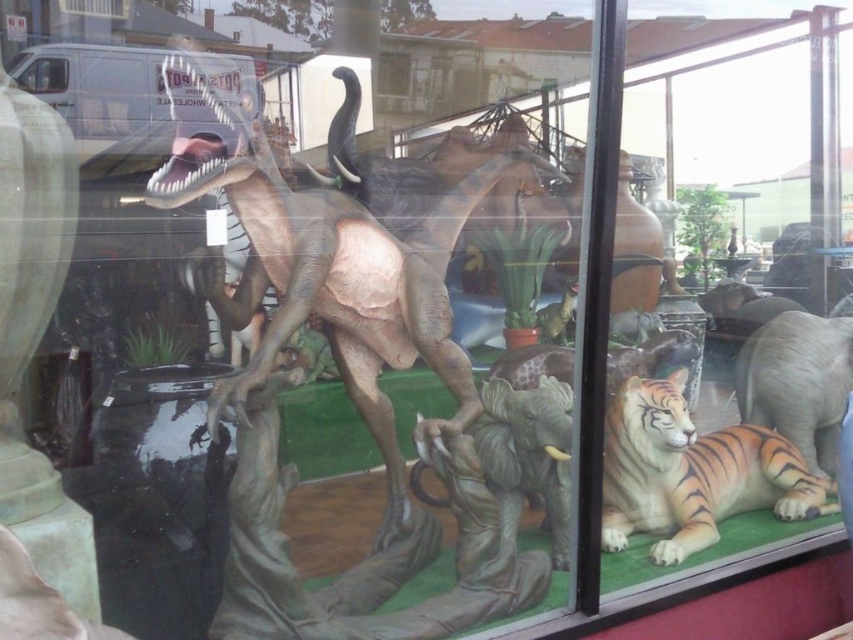
You are standing in front of the display window and want to locate the smooth gray dinosaur at center. Can you tell me its exact coordinates within the image?

The smooth gray dinosaur at center is located at coordinates point (357, 266).

You are standing in front of a display window with animal sculptures. You see a point at coordinates (357, 266). Which sculpture does this point belong to?

The point at coordinates (357, 266) is on the smooth gray dinosaur at center.

You are a delivery person who needs to place a new sculpture exactly halfway between the smooth gray dinosaur at center and the orange striped fur at lower right. The sculptures are 34.60 inches apart. What distance should you measure from each sculpture to place the new sculpture?

The smooth gray dinosaur at center and orange striped fur at lower right are 34.60 inches apart. To place the new sculpture halfway between them, measure 17.3 inches from each sculpture.